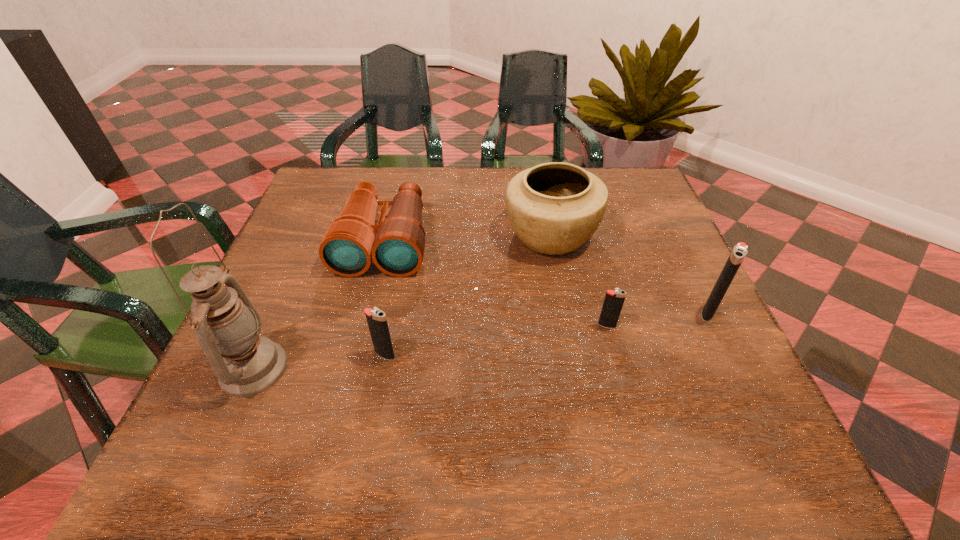
Where is `free space located on the right of the nearest igniter`? free space located on the right of the nearest igniter is located at coordinates (488, 355).

Image resolution: width=960 pixels, height=540 pixels. I want to click on vacant space located 0.230m on the left of the third nearest object, so click(x=481, y=326).

Where is `free region located on the back of the rightmost object`? The height and width of the screenshot is (540, 960). free region located on the back of the rightmost object is located at coordinates (689, 272).

At what (x,y) coordinates should I click in order to perform the action: click on free space located through the lenses of the binoculars. Please return your answer as a coordinate pair (x, y). Image resolution: width=960 pixels, height=540 pixels. Looking at the image, I should click on (361, 336).

The image size is (960, 540). I want to click on vacant space located 0.080m on the back of the pottery, so click(x=542, y=191).

This screenshot has width=960, height=540. Find the location of `blank space located on the right of the leftmost object`. blank space located on the right of the leftmost object is located at coordinates (492, 368).

You are a GUI agent. You are given a task and a screenshot of the screen. Output one action in this format:
    pyautogui.click(x=<x>, y=<y>)
    Task: Click on the binoculars that is at the far edge
    This screenshot has width=960, height=540.
    Given the screenshot: What is the action you would take?
    pyautogui.click(x=396, y=245)

Where is `pottery that is at the far edge`? The height and width of the screenshot is (540, 960). pottery that is at the far edge is located at coordinates (554, 208).

Locate an element on the screen. object located in the near edge section of the desktop is located at coordinates (227, 326).

Find the location of `binoculars that is at the left edge`. binoculars that is at the left edge is located at coordinates (396, 245).